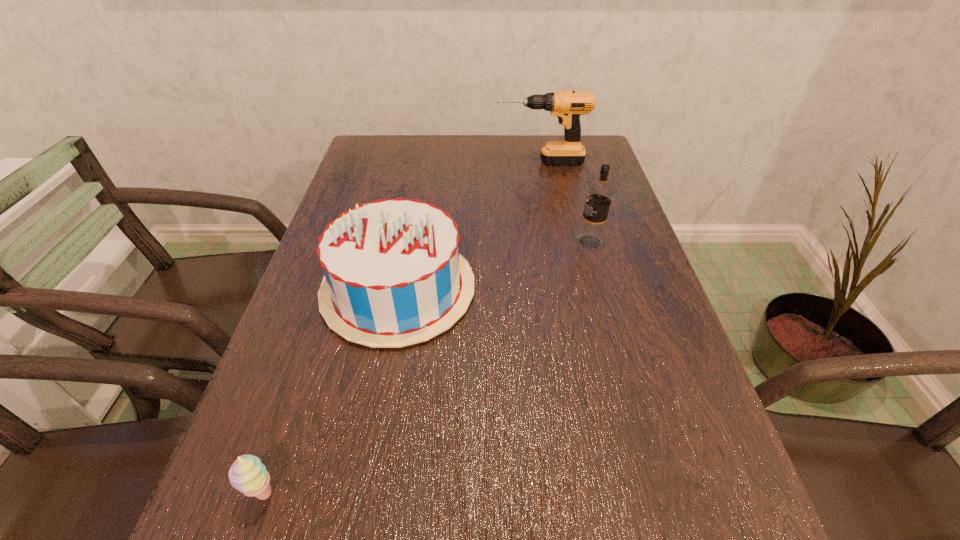
At what (x,y) coordinates should I click in order to perform the action: click on drill. Please return your answer as a coordinate pair (x, y). The width and height of the screenshot is (960, 540). Looking at the image, I should click on (567, 106).

You are a GUI agent. You are given a task and a screenshot of the screen. Output one action in this format:
    pyautogui.click(x=<x>, y=<y>)
    Task: Click on the vodka
    
    Given the screenshot: What is the action you would take?
    pyautogui.click(x=599, y=195)

Identify the location of birthday cake. Image resolution: width=960 pixels, height=540 pixels. (394, 277).

Where is `the nearest object`? the nearest object is located at coordinates (247, 474).

Locate an element on the screen. the shortest object is located at coordinates (247, 474).

Locate an element on the screen. vacant point located at the tip of the drill is located at coordinates (478, 162).

The image size is (960, 540). In order to click on vacant space situated 0.230m at the tip of the drill in this screenshot , I will do `click(420, 162)`.

The image size is (960, 540). Find the location of `free spot located at the tip of the drill`. free spot located at the tip of the drill is located at coordinates (390, 162).

Identify the location of vacant point located on the label of the vodka. Image resolution: width=960 pixels, height=540 pixels. (527, 242).

The image size is (960, 540). What are the coordinates of `free space located 0.080m on the label of the vodka` in the screenshot? It's located at (543, 242).